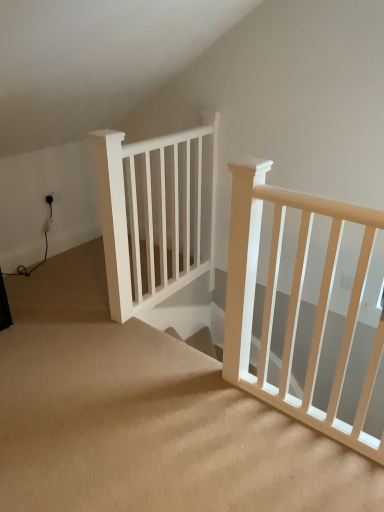
Question: Can you confirm if white wooden rail at center is smaller than beige carpeted stairs at center?

Choices:
 (A) yes
 (B) no

Answer: (A)

Question: Considering the relative positions of white wooden rail at center and beige carpeted stairs at center in the image provided, is white wooden rail at center to the left of beige carpeted stairs at center from the viewer's perspective?

Choices:
 (A) yes
 (B) no

Answer: (B)

Question: Considering the relative sizes of white wooden rail at center and beige carpeted stairs at center in the image provided, is white wooden rail at center bigger than beige carpeted stairs at center?

Choices:
 (A) no
 (B) yes

Answer: (A)

Question: From the image's perspective, is white wooden rail at center located beneath beige carpeted stairs at center?

Choices:
 (A) no
 (B) yes

Answer: (A)

Question: Is white wooden rail at center outside beige carpeted stairs at center?

Choices:
 (A) no
 (B) yes

Answer: (B)

Question: Is white wooden rail at center thinner than beige carpeted stairs at center?

Choices:
 (A) no
 (B) yes

Answer: (B)

Question: Considering the relative sizes of beige carpeted stairs at center and white wooden rail at center in the image provided, is beige carpeted stairs at center wider than white wooden rail at center?

Choices:
 (A) no
 (B) yes

Answer: (B)

Question: Considering the relative sizes of beige carpeted stairs at center and white wooden rail at center in the image provided, is beige carpeted stairs at center smaller than white wooden rail at center?

Choices:
 (A) no
 (B) yes

Answer: (A)

Question: Is beige carpeted stairs at center facing towards white wooden rail at center?

Choices:
 (A) no
 (B) yes

Answer: (A)

Question: From the image's perspective, is beige carpeted stairs at center beneath white wooden rail at center?

Choices:
 (A) yes
 (B) no

Answer: (A)

Question: Is the depth of beige carpeted stairs at center greater than that of white wooden rail at center?

Choices:
 (A) no
 (B) yes

Answer: (A)

Question: Considering the relative positions of beige carpeted stairs at center and white wooden rail at center in the image provided, is beige carpeted stairs at center to the right of white wooden rail at center from the viewer's perspective?

Choices:
 (A) no
 (B) yes

Answer: (A)

Question: In terms of width, does beige carpeted stairs at center look wider or thinner when compared to white wooden rail at center?

Choices:
 (A) wide
 (B) thin

Answer: (A)